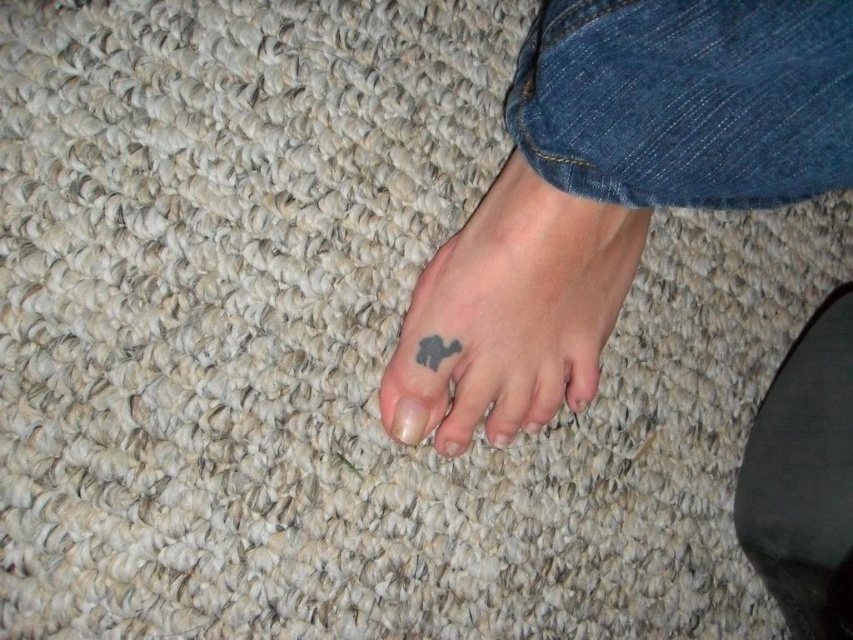
Can you confirm if black matte tattoo at lower left is thinner than black rubber sandal at lower right?

Incorrect, black matte tattoo at lower left's width is not less than black rubber sandal at lower right's.

Who is positioned more to the right, black matte tattoo at lower left or black rubber sandal at lower right?

black rubber sandal at lower right is more to the right.

Between point (779, 42) and point (775, 499), which one is positioned behind?

Positioned behind is point (775, 499).

You are a GUI agent. You are given a task and a screenshot of the screen. Output one action in this format:
    pyautogui.click(x=<x>, y=<y>)
    Task: Click on the black matte tattoo at lower left
    Image resolution: width=853 pixels, height=640 pixels.
    Given the screenshot: What is the action you would take?
    pyautogui.click(x=614, y=188)

Which of these two, black rubber sandal at lower right or matte gray nail at center, stands shorter?

matte gray nail at center is shorter.

Between black rubber sandal at lower right and matte gray nail at center, which one is positioned lower?

black rubber sandal at lower right is lower down.

The image size is (853, 640). I want to click on black rubber sandal at lower right, so click(804, 477).

Is black ink tattoo at lower center to the right of matte gray nail at center from the viewer's perspective?

Yes, black ink tattoo at lower center is to the right of matte gray nail at center.

Between black ink tattoo at lower center and matte gray nail at center, which one appears on the left side from the viewer's perspective?

From the viewer's perspective, matte gray nail at center appears more on the left side.

You are a GUI agent. You are given a task and a screenshot of the screen. Output one action in this format:
    pyautogui.click(x=<x>, y=<y>)
    Task: Click on the black ink tattoo at lower center
    The height and width of the screenshot is (640, 853).
    Given the screenshot: What is the action you would take?
    pyautogui.click(x=514, y=310)